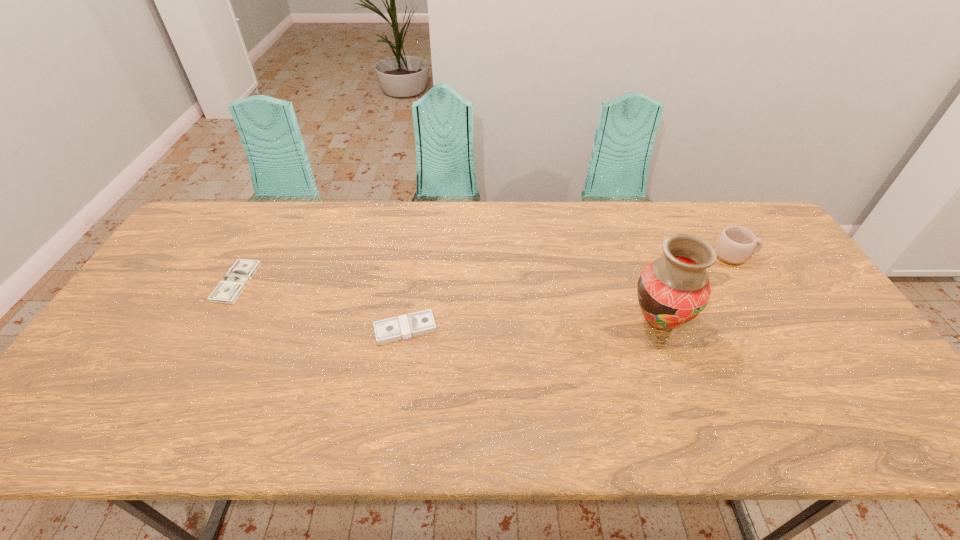
I want to click on vacant area between the right dollar and the second tallest object, so click(x=570, y=292).

Locate an element on the screen. The height and width of the screenshot is (540, 960). free point between the farther dollar and the vase is located at coordinates (447, 301).

You are a GUI agent. You are given a task and a screenshot of the screen. Output one action in this format:
    pyautogui.click(x=<x>, y=<y>)
    Task: Click on the free space between the rightmost object and the nearer dollar
    
    Given the screenshot: What is the action you would take?
    pyautogui.click(x=570, y=292)

The height and width of the screenshot is (540, 960). I want to click on vacant area between the mug and the left dollar, so click(x=486, y=268).

Where is `vacant point located between the mug and the taller dollar`? vacant point located between the mug and the taller dollar is located at coordinates (570, 292).

Where is `vacant space that is in between the tallest object and the taller dollar`? The width and height of the screenshot is (960, 540). vacant space that is in between the tallest object and the taller dollar is located at coordinates (532, 325).

You are a GUI agent. You are given a task and a screenshot of the screen. Output one action in this format:
    pyautogui.click(x=<x>, y=<y>)
    Task: Click on the unoccupied position between the third shortest object and the shorter dollar
    
    Given the screenshot: What is the action you would take?
    pyautogui.click(x=486, y=268)

You are a GUI agent. You are given a task and a screenshot of the screen. Output one action in this format:
    pyautogui.click(x=<x>, y=<y>)
    Task: Click on the free spot between the taller dollar and the mug
    
    Given the screenshot: What is the action you would take?
    (570, 292)

Select which object is the third closest to the third shortest object. Please provide its 2D coordinates. Your answer should be formatted as a tuple, i.e. [(x, y)], where the tuple contains the x and y coordinates of a point satisfying the conditions above.

[(230, 287)]

Locate an element on the screen. The height and width of the screenshot is (540, 960). object that is the second closest to the mug is located at coordinates (401, 327).